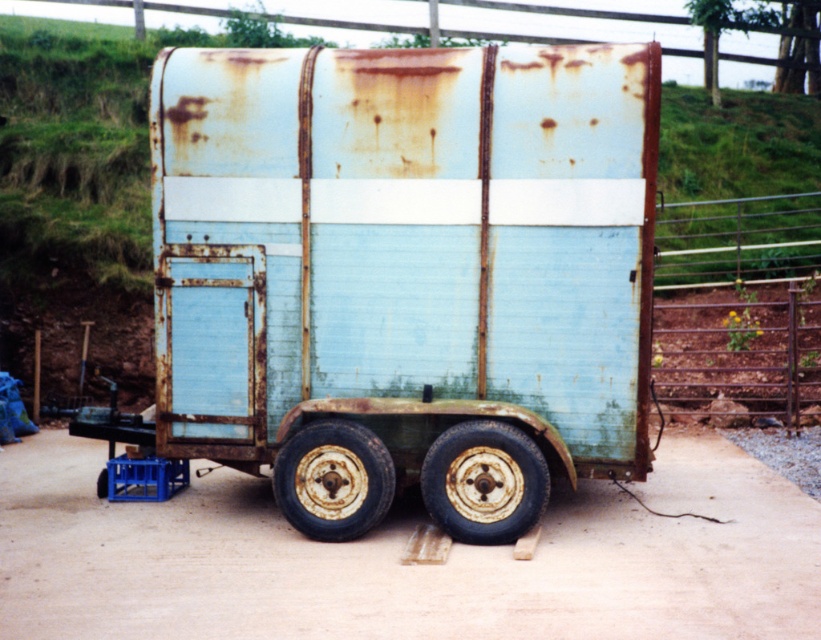
Between point (466, 124) and point (450, 515), which one is positioned behind?

Point (466, 124)

Where is `rusty metal trailer at center`? The image size is (821, 640). rusty metal trailer at center is located at coordinates (409, 262).

Does rusty metal fence at right appear over rusty metal wheel at center?

Yes, rusty metal fence at right is above rusty metal wheel at center.

Measure the distance between point (783,225) and camera.

The distance of point (783,225) from camera is 16.91 meters.

Who is more forward, (682, 340) or (482, 488)?

Point (482, 488) is more forward.

Where is `rusty metal fence at right`? The image size is (821, 640). rusty metal fence at right is located at coordinates (741, 307).

The image size is (821, 640). Describe the element at coordinates (401, 554) in the screenshot. I see `brown dirt track at center` at that location.

Is brown dirt track at center positioned at the back of rusty metal wheel at center?

No.

Find the location of a particular element. brown dirt track at center is located at coordinates (401, 554).

Locate an element on the screen. The height and width of the screenshot is (640, 821). brown dirt track at center is located at coordinates (401, 554).